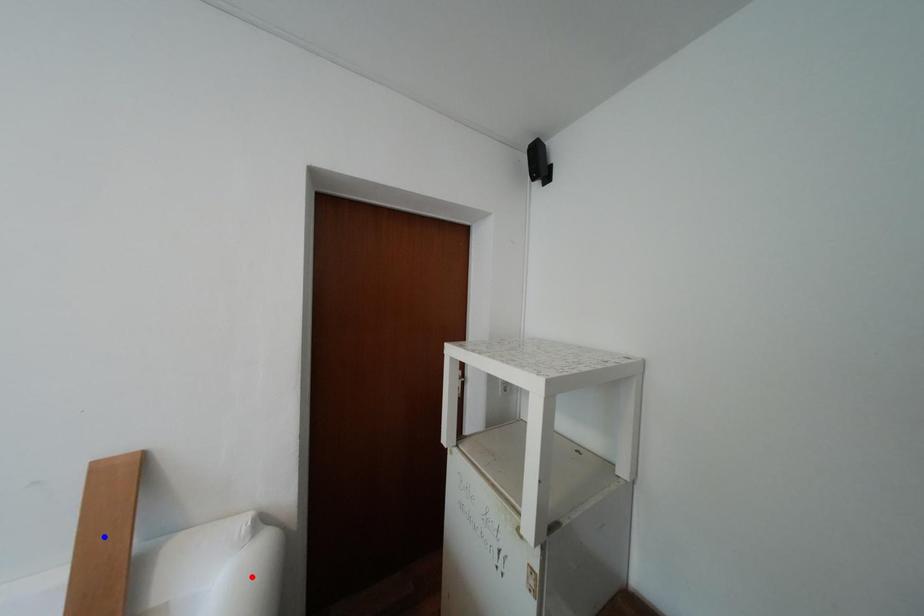
Question: Which of the two points in the image is closer to the camera?

Choices:
 (A) Blue point is closer.
 (B) Red point is closer.

Answer: (A)